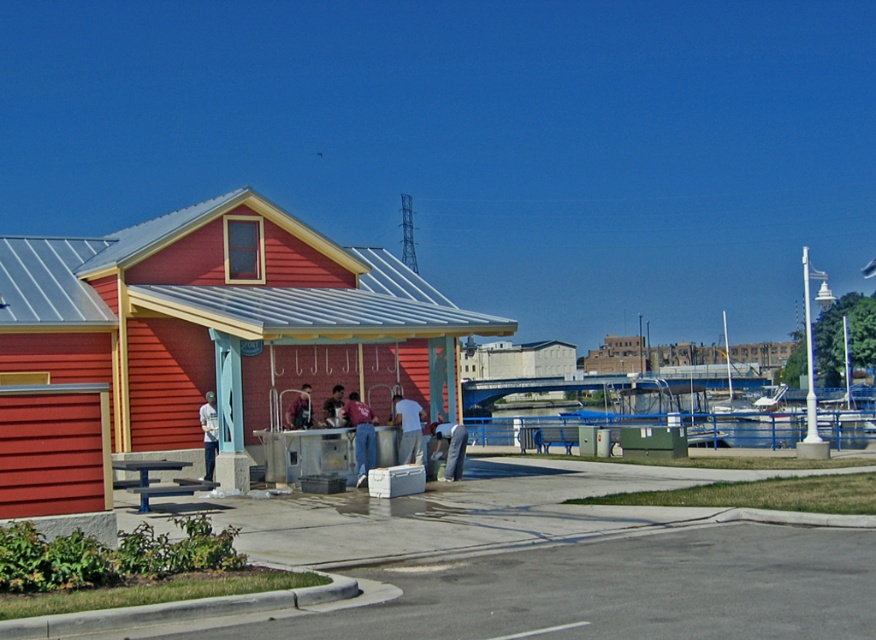
Which of these two, matte red shirt at center or white matte shirt at center, stands taller?

matte red shirt at center is taller.

Is matte red shirt at center above white matte shirt at center?

No.

Find the location of a particular element. The height and width of the screenshot is (640, 876). matte red shirt at center is located at coordinates (359, 433).

Consider the image. Is transparent blue water at lower center positioned in front of white matte shirt at center?

No.

Consider the image. Can you confirm if transparent blue water at lower center is bigger than white matte shirt at center?

Yes.

Is point (753, 445) farther from camera compared to point (400, 400)?

Yes.

This screenshot has height=640, width=876. Identify the location of transparent blue water at lower center. (754, 432).

Does gray fabric pants at center have a lesser width compared to denim jacket at left?

No, gray fabric pants at center is not thinner than denim jacket at left.

From the picture: Who is taller, gray fabric pants at center or denim jacket at left?

denim jacket at left

The height and width of the screenshot is (640, 876). What do you see at coordinates (451, 449) in the screenshot?
I see `gray fabric pants at center` at bounding box center [451, 449].

Locate an element on the screen. The width and height of the screenshot is (876, 640). gray fabric pants at center is located at coordinates (451, 449).